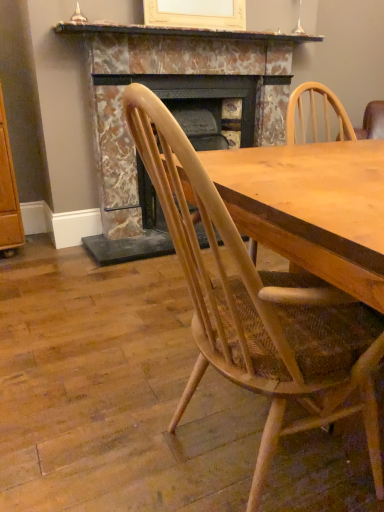
Question: Is marble fireplace at center inside the boundaries of natural wood chair at center, or outside?

Choices:
 (A) inside
 (B) outside

Answer: (B)

Question: From a real-world perspective, is marble fireplace at center above or below natural wood chair at center?

Choices:
 (A) above
 (B) below

Answer: (A)

Question: Which object is positioned farthest from the marble fireplace at center?

Choices:
 (A) marble mantel at upper center
 (B) natural wood chair at center

Answer: (B)

Question: Based on their relative distances, which object is nearer to the natural wood chair at center?

Choices:
 (A) marble fireplace at center
 (B) marble mantel at upper center

Answer: (A)